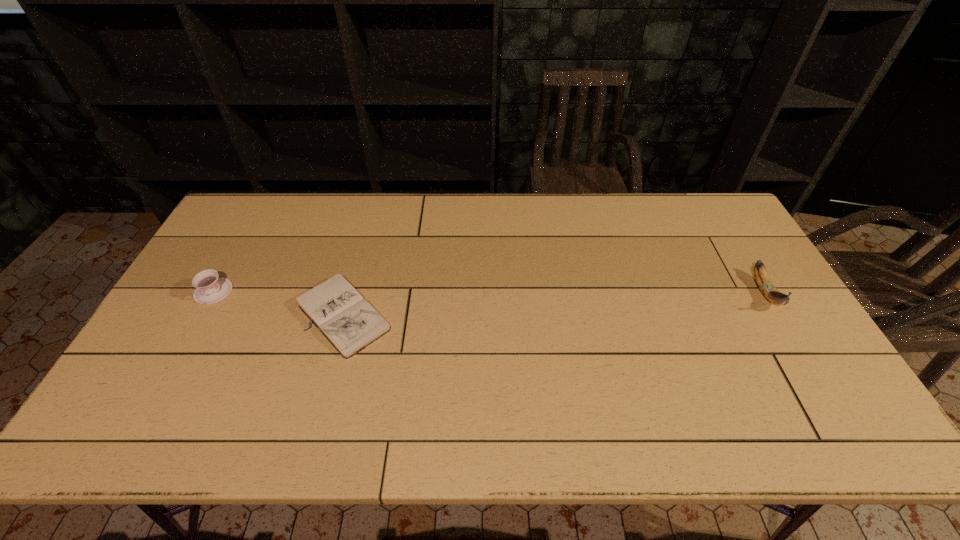
Find the location of a particular element. object present at the right edge is located at coordinates (765, 285).

Locate an element on the screen. vacant space at the far edge is located at coordinates (381, 218).

The height and width of the screenshot is (540, 960). Find the location of `vacant space at the near edge`. vacant space at the near edge is located at coordinates (461, 427).

The image size is (960, 540). Identify the location of vacant space at the left edge of the desktop. (242, 247).

I want to click on free location at the right edge, so click(769, 330).

Image resolution: width=960 pixels, height=540 pixels. Identify the location of vacant space at the far left corner of the desktop. (244, 206).

The image size is (960, 540). What are the coordinates of `free point at the far right corner` in the screenshot? It's located at (734, 231).

The image size is (960, 540). Find the location of `vacant space at the near right corner of the desktop`. vacant space at the near right corner of the desktop is located at coordinates (845, 423).

I want to click on vacant point located between the rightmost object and the notebook, so click(x=555, y=303).

Find the location of `vacant point located between the teacup and the tallest object`. vacant point located between the teacup and the tallest object is located at coordinates (490, 292).